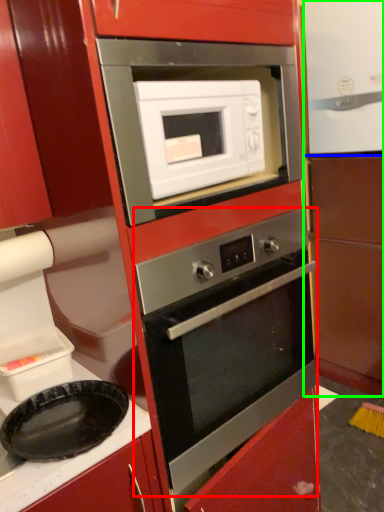
Question: Based on their relative distances, which object is farther from oven (highlighted by a red box)? Choose from appliance (highlighted by a blue box) and cabinetry (highlighted by a green box).

Choices:
 (A) appliance
 (B) cabinetry

Answer: (A)